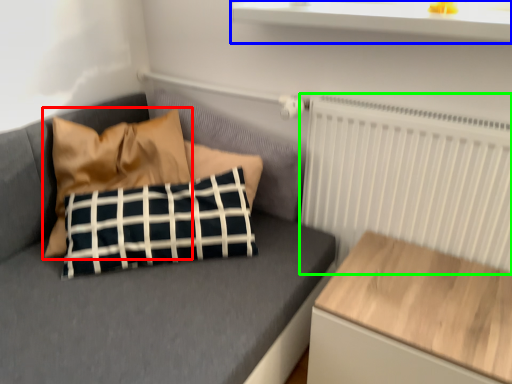
Question: Considering the real-world distances, which object is closest to pillow (highlighted by a red box)? window sill (highlighted by a blue box) or radiator (highlighted by a green box).

Choices:
 (A) window sill
 (B) radiator

Answer: (A)